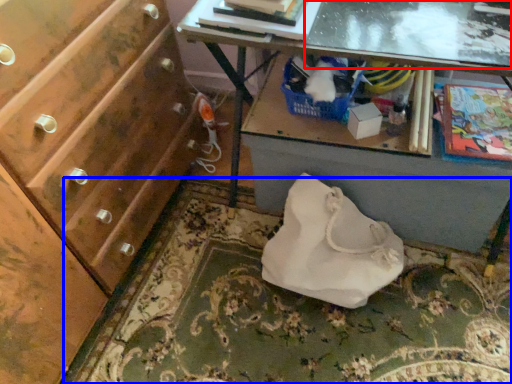
Question: Which object is closer to the camera taking this photo, glass table (highlighted by a red box) or mat (highlighted by a blue box)?

Choices:
 (A) glass table
 (B) mat

Answer: (A)